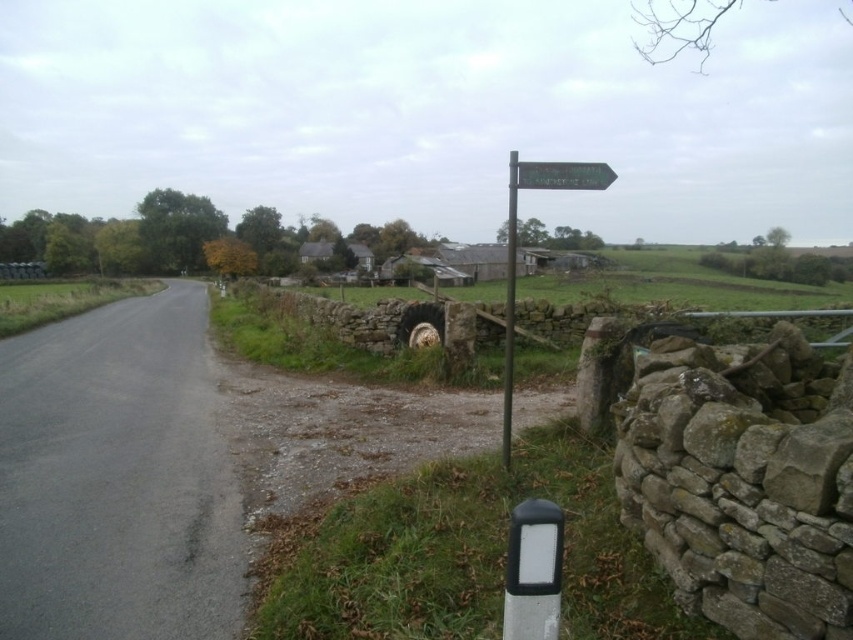
You are driving a delivery truck that is 10 meters long. You need to make a U turn on the road between the silver metallic signpost at upper center and the green wooden signpost at upper right. Can you safely complete the U turn without crossing the road boundaries or hitting the signposts?

The distance between the silver metallic signpost at upper center and the green wooden signpost at upper right is 23.71 meters. Since your truck is 10 meters long, there is sufficient space to perform the U turn safely between them without crossing the road boundaries or hitting the signposts.